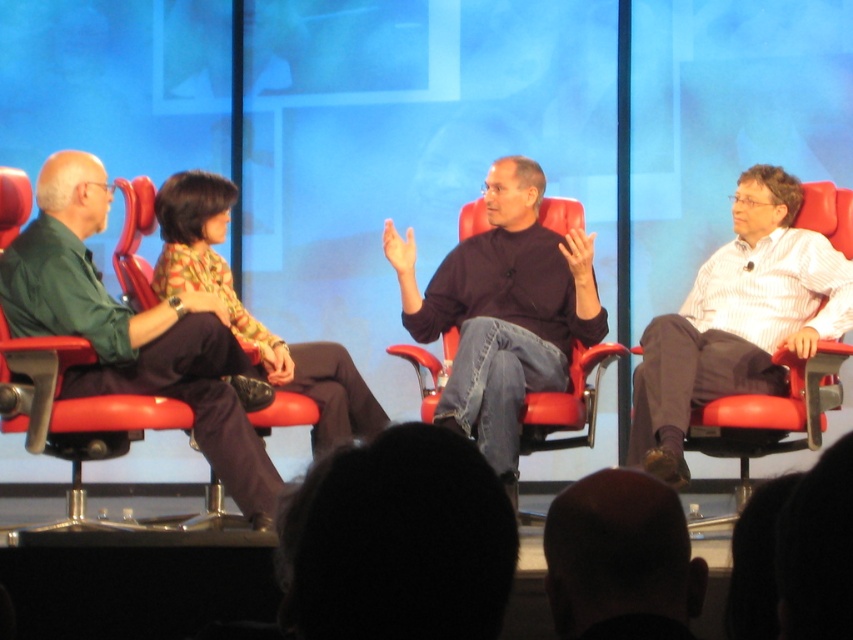
Question: Where is bald head at center located in relation to printed fabric blouse at center in the image?

Choices:
 (A) left
 (B) right

Answer: (B)

Question: Estimate the real-world distances between objects in this image. Which object is closer to the white striped shirt at right?

Choices:
 (A) green fabric shirt at left
 (B) bald head at center
 (C) dark brown sweater at center
 (D) printed fabric blouse at center

Answer: (C)

Question: Among these objects, which one is nearest to the camera?

Choices:
 (A) dark brown sweater at center
 (B) bald head at center
 (C) green fabric shirt at left

Answer: (B)

Question: Which point appears closest to the camera in this image?

Choices:
 (A) (584, 305)
 (B) (567, 552)

Answer: (B)

Question: Is dark brown sweater at center below printed fabric blouse at center?

Choices:
 (A) yes
 (B) no

Answer: (B)

Question: Does green fabric shirt at left have a larger size compared to dark brown sweater at center?

Choices:
 (A) yes
 (B) no

Answer: (B)